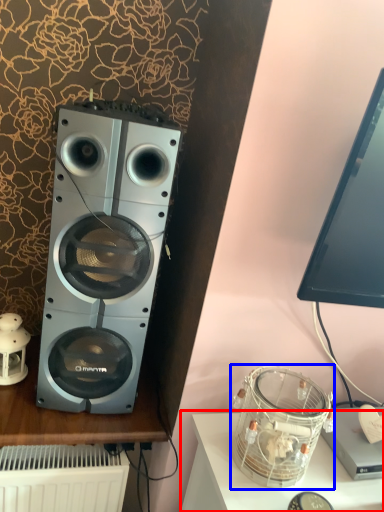
Question: Which object appears farthest to the camera in this image, furniture (highlighted by a red box) or appliance (highlighted by a blue box)?

Choices:
 (A) furniture
 (B) appliance

Answer: (B)